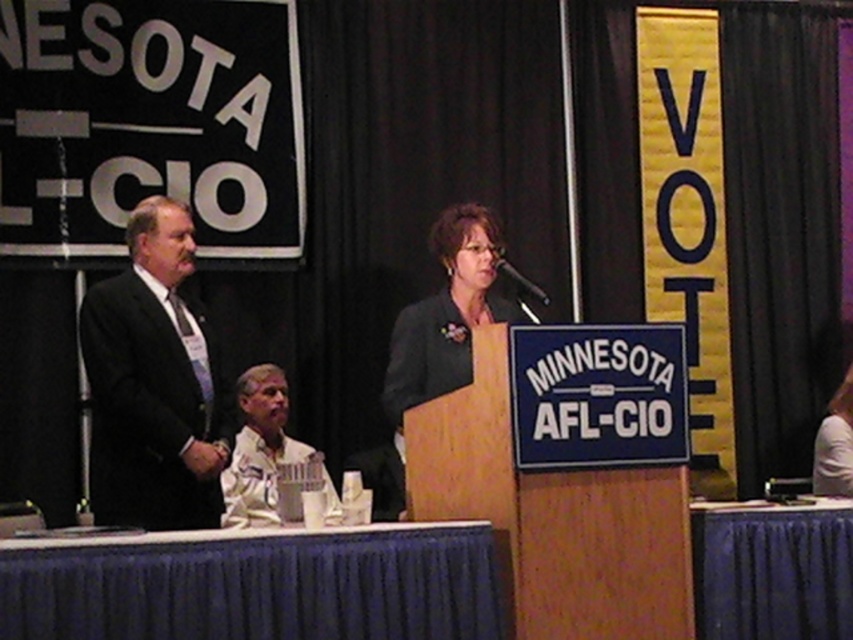
Consider the image. Does matte black suit at left have a smaller size compared to matte black blazer at center?

Yes.

Where is `matte black suit at left`? matte black suit at left is located at coordinates (152, 381).

Can you confirm if matte black suit at left is positioned below white fabric shirt at lower right?

Incorrect, matte black suit at left is not positioned below white fabric shirt at lower right.

Between point (206, 376) and point (834, 481), which one is positioned in front?

Positioned in front is point (206, 376).

At what (x,y) coordinates should I click in order to perform the action: click on matte black suit at left. Please return your answer as a coordinate pair (x, y). Looking at the image, I should click on (152, 381).

Is matte black blazer at center positioned before white fabric shirt at lower right?

Yes, it is in front of white fabric shirt at lower right.

Is point (456, 362) closer to camera compared to point (851, 376)?

Yes, it is in front of point (851, 376).

Identify the location of matte black blazer at center. Image resolution: width=853 pixels, height=640 pixels. (445, 314).